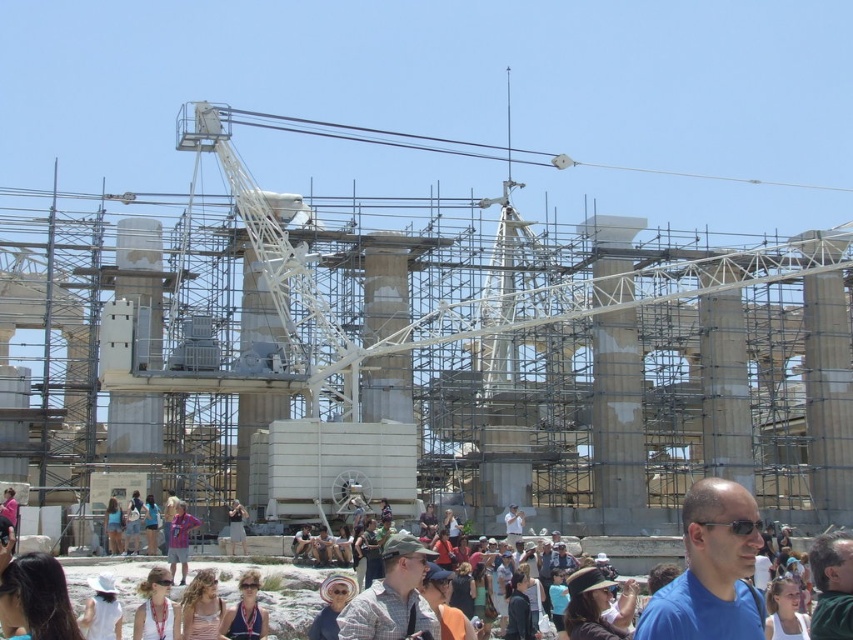
Question: Based on their relative distances, which object is nearer to the white fabric sunglasses at center?

Choices:
 (A) matte purple dress at center
 (B) blonde hair at lower center
 (C) blue denim shorts at center
 (D) denim jacket at center

Answer: (B)

Question: Is matte purple dress at center closer to camera compared to blue denim shorts at center?

Choices:
 (A) yes
 (B) no

Answer: (A)

Question: Which is nearer to the white fabric sunglasses at center?

Choices:
 (A) blonde hair at lower center
 (B) denim jacket at center

Answer: (A)

Question: Can you confirm if white fabric dress at center is thinner than blue denim shorts at center?

Choices:
 (A) yes
 (B) no

Answer: (B)

Question: Which object appears farthest from the camera in this image?

Choices:
 (A) blonde hair at lower center
 (B) matte purple dress at center

Answer: (B)

Question: Does white fabric sunglasses at center come in front of white fabric dress at center?

Choices:
 (A) no
 (B) yes

Answer: (B)